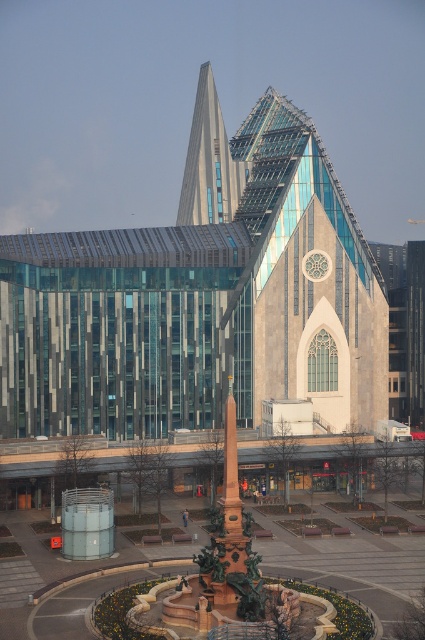
Is point (195, 93) more distant than point (73, 497)?

Yes, it is behind point (73, 497).

Find the location of a particular element. transparent glass tower at center is located at coordinates (209, 161).

The height and width of the screenshot is (640, 425). Find the location of `transparent glass tower at center`. transparent glass tower at center is located at coordinates (209, 161).

Between stone church at center and transparent glass tower at center, which one has less height?

transparent glass tower at center is shorter.

How distant is stone church at center from transparent glass tower at center?

They are 16.12 meters apart.

Identify the location of stone church at center. (201, 298).

Find the location of `stone church at center`. stone church at center is located at coordinates (201, 298).

Between stone church at center and polished bronze obelisk at center, which one appears on the right side from the viewer's perspective?

stone church at center is more to the right.

Which is below, stone church at center or polished bronze obelisk at center?

polished bronze obelisk at center is lower down.

Who is more distant from viewer, [113,349] or [102,516]?

The point [113,349] is more distant.

In order to click on stone church at center in this screenshot , I will do `click(201, 298)`.